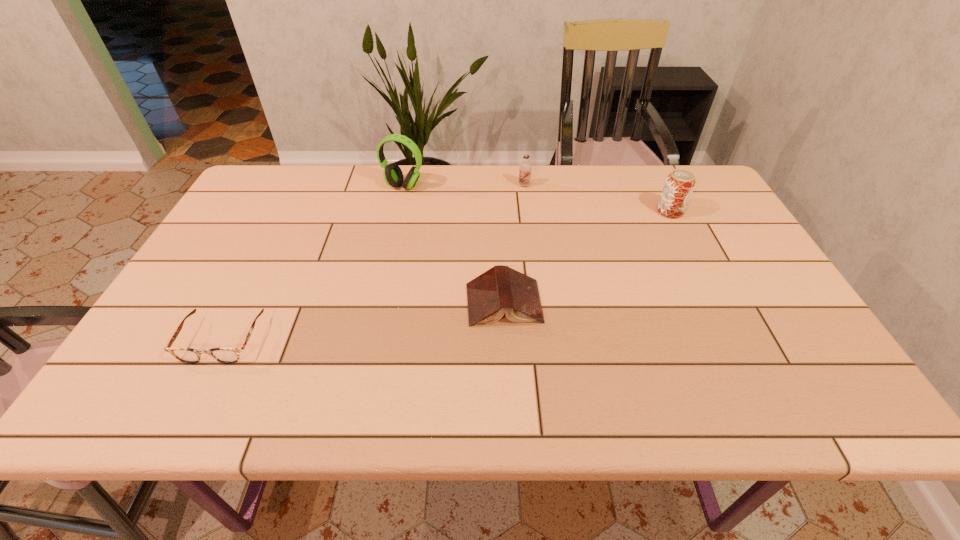
Find the location of `blank area located 0.230m on the left of the third shortest object`. blank area located 0.230m on the left of the third shortest object is located at coordinates pyautogui.click(x=445, y=185).

Locate an element on the screen. The image size is (960, 540). free space located on the right of the second shortest object is located at coordinates (592, 303).

Find the location of `vacant area situated 0.070m on the frame of the leftmost object`. vacant area situated 0.070m on the frame of the leftmost object is located at coordinates (195, 394).

Identify the location of headset at the far edge. (392, 173).

Find the location of a particular element. The image size is (960, 540). beer can that is at the far edge is located at coordinates (679, 185).

Locate an element on the screen. This screenshot has height=540, width=960. chocolate milk that is at the far edge is located at coordinates click(x=525, y=168).

Where is `object at the left edge`? object at the left edge is located at coordinates (188, 355).

In order to click on object that is at the right edge in this screenshot , I will do `click(679, 185)`.

Identify the location of object located at the far right corner. (679, 185).

Find the location of a particular element. This screenshot has height=540, width=960. vacant space at the far edge is located at coordinates (516, 202).